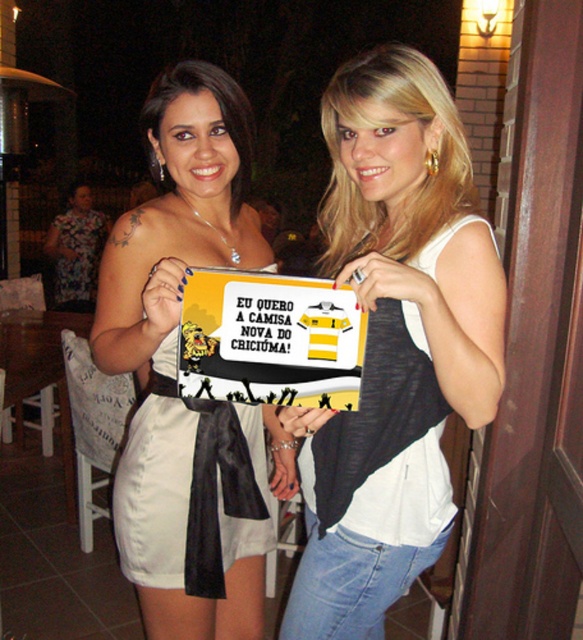
You are at a social event and see the yellow and black jersey at center and the matte white dress at center. Which one is positioned more to the right side?

The yellow and black jersey at center is positioned more to the right side than the matte white dress at center.

You are organizing a sports event and need to display two items. The yellow and black jersey at center and the floral fabric dress at left. Which item is narrower when viewed from the front?

The yellow and black jersey at center is narrower compared to the floral fabric dress at left.